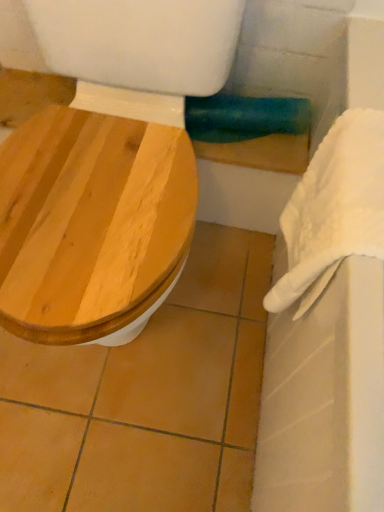
Question: Considering the relative positions of white fluffy towel at right and wooden toilet seat at left in the image provided, is white fluffy towel at right in front of wooden toilet seat at left?

Choices:
 (A) no
 (B) yes

Answer: (A)

Question: From the image's perspective, would you say white fluffy towel at right is positioned over wooden toilet seat at left?

Choices:
 (A) yes
 (B) no

Answer: (B)

Question: Is white fluffy towel at right not inside wooden toilet seat at left?

Choices:
 (A) yes
 (B) no

Answer: (A)

Question: From a real-world perspective, does white fluffy towel at right sit lower than wooden toilet seat at left?

Choices:
 (A) yes
 (B) no

Answer: (B)

Question: Can you confirm if white fluffy towel at right is positioned to the right of wooden toilet seat at left?

Choices:
 (A) yes
 (B) no

Answer: (A)

Question: In the image, is white fluffy towel at right on the left side or the right side of white fabric towel bar at upper right?

Choices:
 (A) left
 (B) right

Answer: (B)

Question: Is point (370, 164) closer or farther from the camera than point (190, 120)?

Choices:
 (A) closer
 (B) farther

Answer: (A)

Question: Considering the positions of white fluffy towel at right and white fabric towel bar at upper right in the image, is white fluffy towel at right wider or thinner than white fabric towel bar at upper right?

Choices:
 (A) wide
 (B) thin

Answer: (A)

Question: From a real-world perspective, is white fluffy towel at right above or below white fabric towel bar at upper right?

Choices:
 (A) below
 (B) above

Answer: (B)

Question: In terms of height, does white fabric towel bar at upper right look taller or shorter compared to white fluffy towel at right?

Choices:
 (A) short
 (B) tall

Answer: (A)

Question: Is white fabric towel bar at upper right in front of or behind white fluffy towel at right in the image?

Choices:
 (A) front
 (B) behind

Answer: (B)

Question: Does point (248, 110) appear closer or farther from the camera than point (362, 239)?

Choices:
 (A) closer
 (B) farther

Answer: (B)

Question: From the image's perspective, is white fabric towel bar at upper right positioned above or below white fluffy towel at right?

Choices:
 (A) below
 (B) above

Answer: (B)

Question: Is white fabric towel bar at upper right in front of or behind wooden toilet seat at left in the image?

Choices:
 (A) behind
 (B) front

Answer: (A)

Question: Considering the positions of white fabric towel bar at upper right and wooden toilet seat at left in the image, is white fabric towel bar at upper right bigger or smaller than wooden toilet seat at left?

Choices:
 (A) big
 (B) small

Answer: (B)